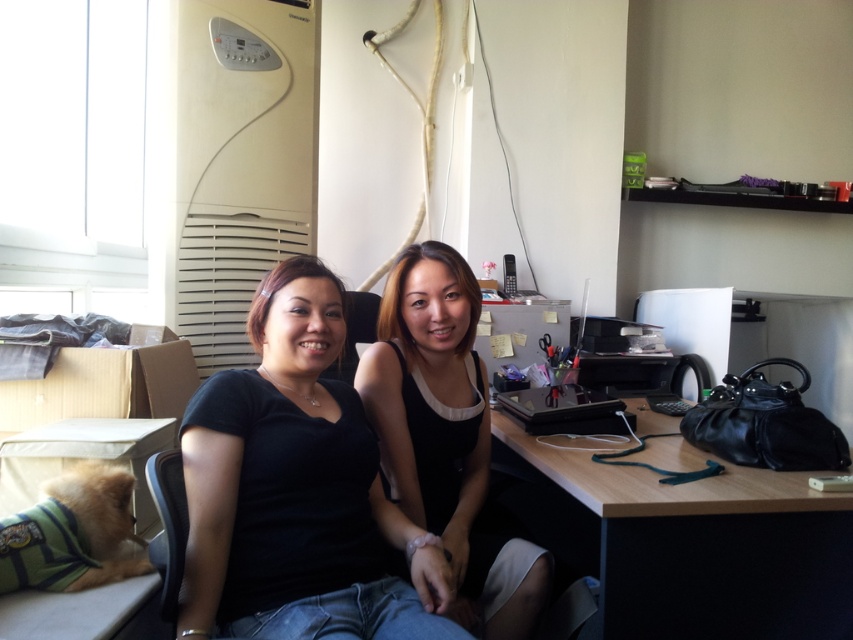
Based on the photo, can you confirm if black matte shirt at center is bigger than wooden desk at right?

Incorrect, black matte shirt at center is not larger than wooden desk at right.

Which is in front, point (213, 563) or point (506, 454)?

Point (213, 563)

The height and width of the screenshot is (640, 853). What are the coordinates of `black matte shirt at center` in the screenshot? It's located at (297, 490).

Can you confirm if black matte shirt at center is thinner than black matte dress at center?

No, black matte shirt at center is not thinner than black matte dress at center.

Identify the location of black matte shirt at center. This screenshot has width=853, height=640. coord(297,490).

Is point (238, 385) closer to camera compared to point (444, 412)?

Yes.

Locate an element on the screen. This screenshot has height=640, width=853. black matte shirt at center is located at coordinates (297, 490).

Can you confirm if wooden desk at right is wider than black matte dress at center?

Yes.

Is wooden desk at right smaller than black matte dress at center?

Actually, wooden desk at right might be larger than black matte dress at center.

Is point (515, 493) positioned before point (518, 616)?

No, it is behind (518, 616).

The height and width of the screenshot is (640, 853). I want to click on wooden desk at right, so click(x=683, y=541).